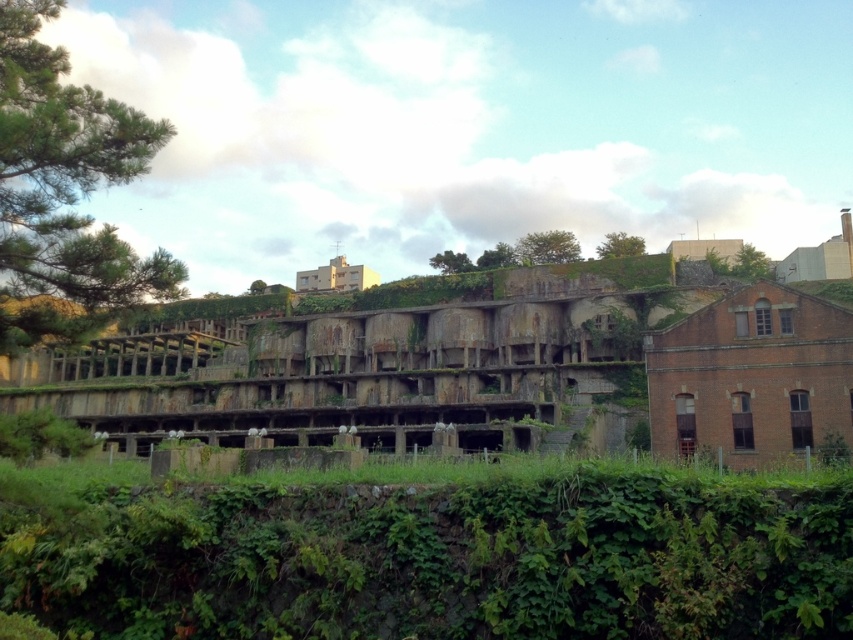
Question: Does green leafy tree at left have a larger size compared to green leafy vegetation at upper center?

Choices:
 (A) yes
 (B) no

Answer: (B)

Question: Which object appears closest to the camera in this image?

Choices:
 (A) green leafy vegetation at upper center
 (B) rusty concrete ruins at center
 (C) green leafy tree at left
 (D) green leafy vegetation at center

Answer: (C)

Question: Does rusty concrete ruins at center appear under green leafy tree at left?

Choices:
 (A) no
 (B) yes

Answer: (B)

Question: Which of the following is the farthest from the observer?

Choices:
 (A) (41, 64)
 (B) (589, 349)

Answer: (B)

Question: In this image, where is rusty concrete ruins at center located relative to green leafy vegetation at upper center?

Choices:
 (A) above
 (B) below

Answer: (B)

Question: Which point appears closest to the camera in this image?

Choices:
 (A) (457, 490)
 (B) (7, 120)

Answer: (B)